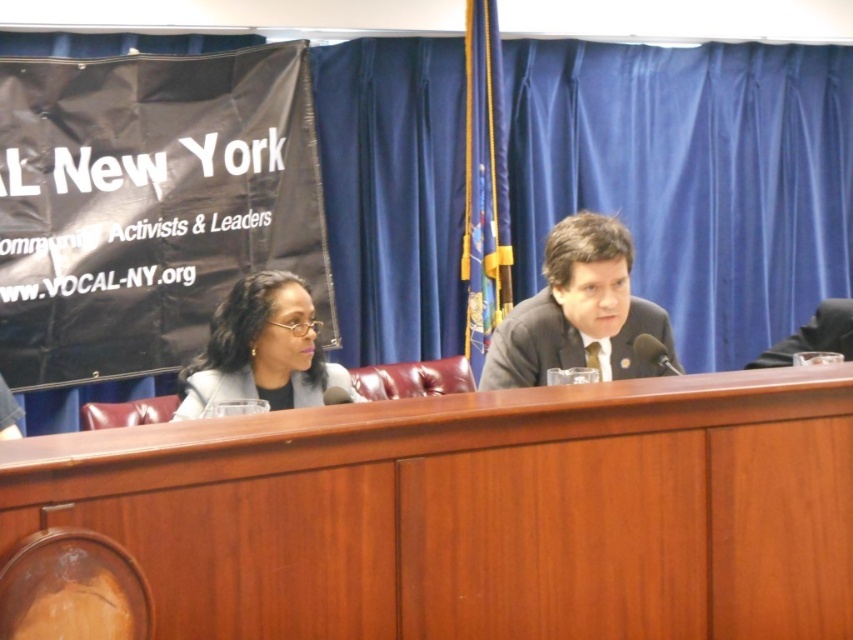
You are a photographer setting up for a group photo. You need to place a 15 cm tall tripod on the wooden table at center so that it doesn t block the matte black glasses at center. Is this possible?

The wooden table at center is taller than matte black glasses at center, so placing a 15 cm tall tripod on the wooden table at center won t block the matte black glasses at center as the table provides enough vertical space.

You are an event planner arranging chairs for an audience facing the panel desk. You need to ensure that the chairs are placed so that the audience can see both the dark gray suit at center and the matte black glasses at center clearly. Considering their positions and sizes, which object might require more space between the front row and the panel desk to avoid obstruction?

The dark gray suit at center might require more space between the front row and the panel desk because it is wider than the matte black glasses at center, potentially blocking the view if too close.